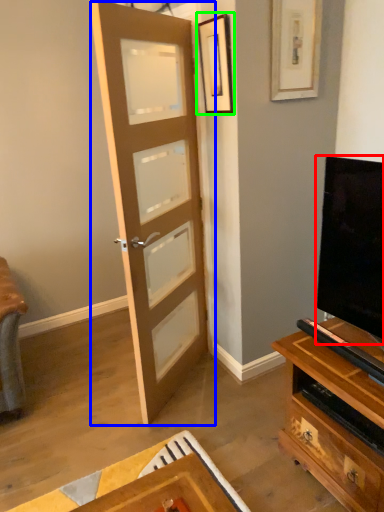
Question: Based on their relative distances, which object is farther from television (highlighted by a red box)? Choose from door (highlighted by a blue box) and picture frame (highlighted by a green box).

Choices:
 (A) door
 (B) picture frame

Answer: (B)